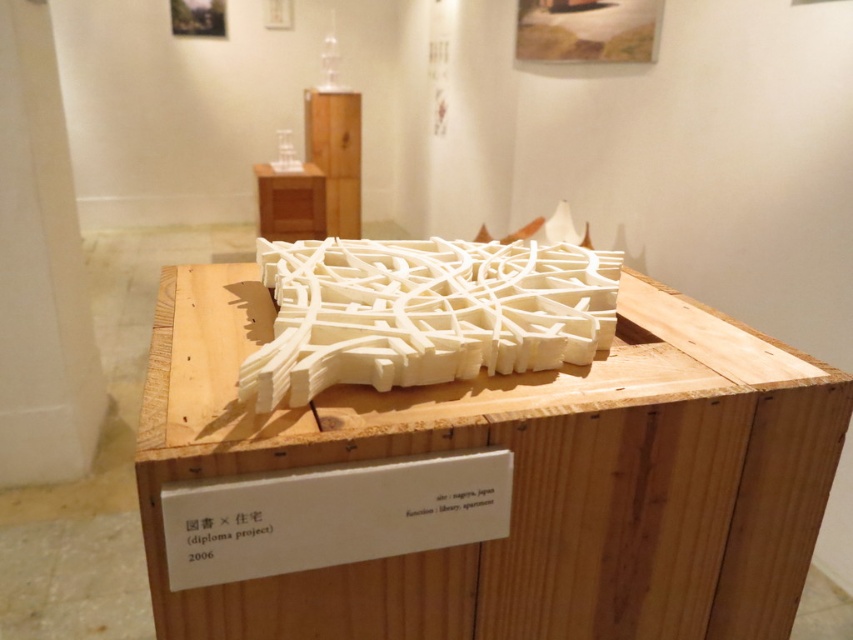
You are standing in an exhibition hall and see the white wood crate at center. If you want to reach into the crate to retrieve an item, will you be able to do so comfortably without moving your feet? Please explain your reasoning based on the distance between you and the crate.

The white wood crate at center is 72.40 centimeters away from the viewer. Considering an average person has an arm length of about 70 centimeters, reaching 72.40 centimeters might require stretching slightly, but it is possible to reach into the crate without moving the feet. However, comfort may depend on individual arm length and flexibility.

You are an architect examining the architectural model displayed on the wooden pedestal. You notice the white wood crate at center. Can you determine its exact 2D coordinates in the image?

The white wood crate at center is located at the 2D coordinates of point (485, 484).

You are an architect visiting an exhibition and see the white wood crate at center and the white matte maze at center displayed on a pedestal. From your perspective, which object is positioned to the right side?

The white wood crate at center is to the right of the white matte maze at center, so the white wood crate at center is positioned to the right side.